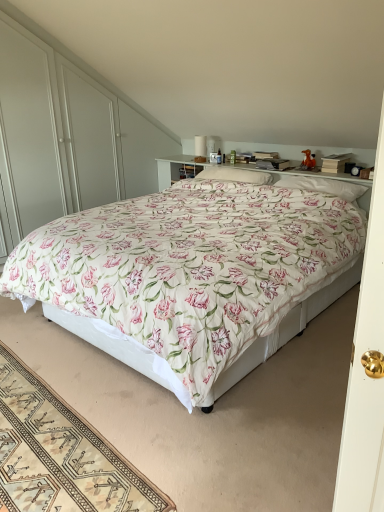
Question: Which direction should I rotate to face white soft pillow at upper center, positioned as the 1th pillow in right-to-left order, — up or down?

Choices:
 (A) down
 (B) up

Answer: (B)

Question: Can you confirm if beige woven rug at lower left is positioned to the right of white soft pillow at upper center, positioned as the 1th pillow in right-to-left order?

Choices:
 (A) yes
 (B) no

Answer: (B)

Question: Considering the relative sizes of beige woven rug at lower left and white soft pillow at upper center, positioned as the 1th pillow in right-to-left order, in the image provided, is beige woven rug at lower left bigger than white soft pillow at upper center, positioned as the 1th pillow in right-to-left order,?

Choices:
 (A) no
 (B) yes

Answer: (B)

Question: Considering the relative sizes of beige woven rug at lower left and white soft pillow at upper center, acting as the second pillow starting from the left, in the image provided, is beige woven rug at lower left taller than white soft pillow at upper center, acting as the second pillow starting from the left,?

Choices:
 (A) yes
 (B) no

Answer: (B)

Question: Does beige woven rug at lower left have a lesser width compared to white soft pillow at upper center, positioned as the 1th pillow in right-to-left order?

Choices:
 (A) yes
 (B) no

Answer: (B)

Question: Considering the relative sizes of beige woven rug at lower left and white soft pillow at upper center, acting as the second pillow starting from the left, in the image provided, is beige woven rug at lower left wider than white soft pillow at upper center, acting as the second pillow starting from the left,?

Choices:
 (A) yes
 (B) no

Answer: (A)

Question: Does beige woven rug at lower left appear on the left side of white soft pillow at upper center, acting as the second pillow starting from the left?

Choices:
 (A) no
 (B) yes

Answer: (B)

Question: Is beige woven rug at lower left positioned far away from floral fabric bed at center?

Choices:
 (A) no
 (B) yes

Answer: (A)

Question: Is beige woven rug at lower left behind floral fabric bed at center?

Choices:
 (A) yes
 (B) no

Answer: (B)

Question: Considering the relative sizes of beige woven rug at lower left and floral fabric bed at center in the image provided, is beige woven rug at lower left thinner than floral fabric bed at center?

Choices:
 (A) no
 (B) yes

Answer: (B)

Question: Is floral fabric bed at center a part of beige woven rug at lower left?

Choices:
 (A) yes
 (B) no

Answer: (B)

Question: From the image's perspective, is beige woven rug at lower left beneath floral fabric bed at center?

Choices:
 (A) yes
 (B) no

Answer: (A)

Question: Considering the relative sizes of beige woven rug at lower left and floral fabric bed at center in the image provided, is beige woven rug at lower left taller than floral fabric bed at center?

Choices:
 (A) yes
 (B) no

Answer: (B)

Question: Does white soft pillow at upper center, acting as the second pillow starting from the left, turn towards floral fabric bed at center?

Choices:
 (A) yes
 (B) no

Answer: (A)